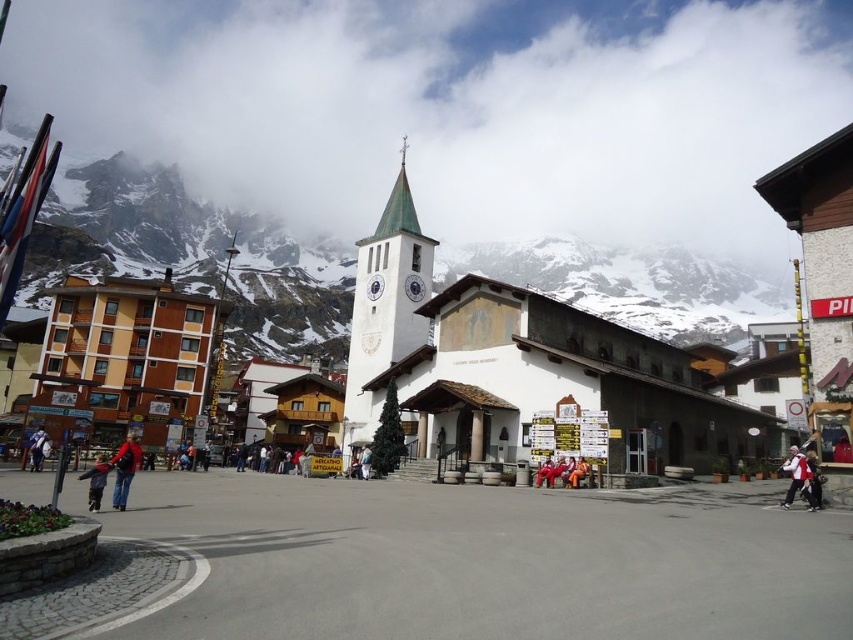
Question: Can you confirm if yellow wood building at left is thinner than white cotton jacket at lower right?

Choices:
 (A) yes
 (B) no

Answer: (B)

Question: Considering the real-world distances, which object is farthest from the snowy rock at upper center?

Choices:
 (A) blue denim jacket at lower left
 (B) blue fabric jacket at lower left
 (C) white smooth church at center
 (D) white smooth clock tower at center

Answer: (A)

Question: Which of the following is the farthest from the observer?

Choices:
 (A) yellow wood building at left
 (B) blue denim jacket at lower left

Answer: (A)

Question: Does white smooth church at center have a larger size compared to yellow wood building at left?

Choices:
 (A) yes
 (B) no

Answer: (B)

Question: Is denim pants at lower left further to camera compared to white cotton jacket at lower right?

Choices:
 (A) yes
 (B) no

Answer: (B)

Question: Which of these objects is positioned closest to the snowy rock at upper center?

Choices:
 (A) denim pants at lower left
 (B) white cotton jacket at center
 (C) yellow wood building at left
 (D) blue denim jacket at lower left

Answer: (C)